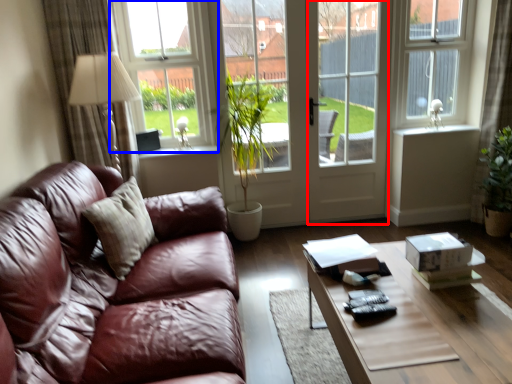
Question: Among these objects, which one is farthest to the camera, screen door (highlighted by a red box) or window (highlighted by a blue box)?

Choices:
 (A) screen door
 (B) window

Answer: (A)